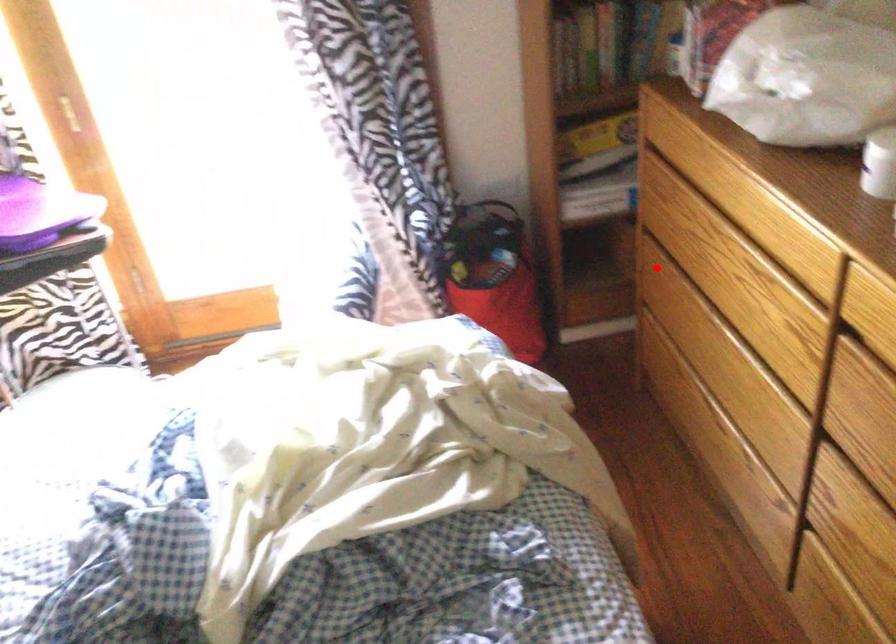
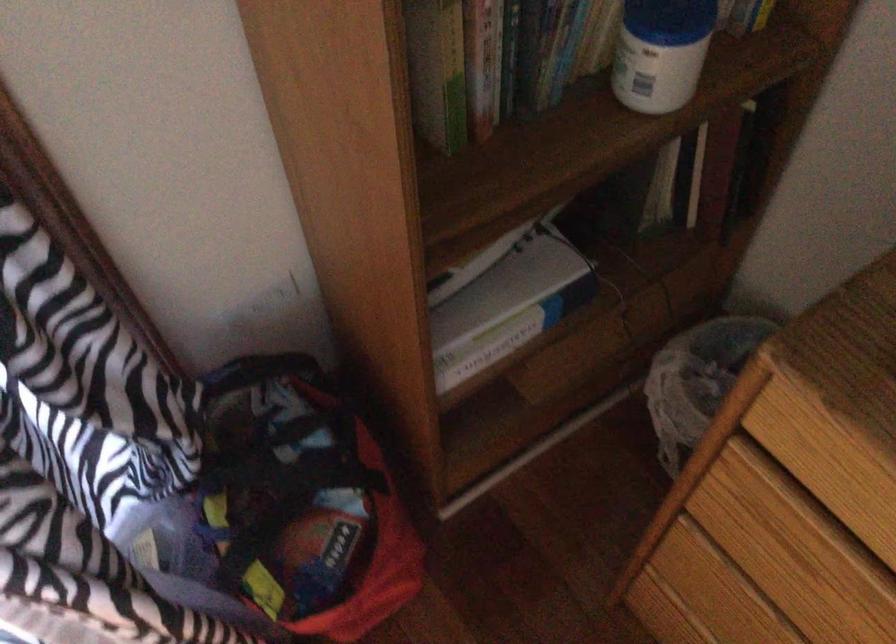
Find the pixel in the second image that matches the highlighted location in the first image.

(717, 590)